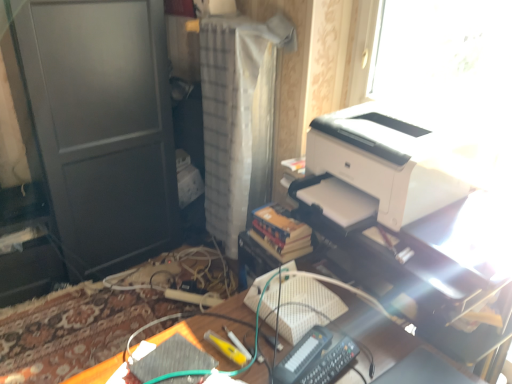
Describe the element at coordinates (395, 157) in the screenshot. This screenshot has height=384, width=512. I see `white matte printer at upper right` at that location.

This screenshot has width=512, height=384. I want to click on black plastic remote control at center, so click(315, 359).

Does point (233, 233) come closer to viewer compared to point (402, 350)?

No, it is behind (402, 350).

Where is `curtain that is above the wooden desk at center (from the image's perspective)`? The image size is (512, 384). curtain that is above the wooden desk at center (from the image's perspective) is located at coordinates (234, 114).

Is white textured curtain at center far from wooden desk at center?

white textured curtain at center is near wooden desk at center, not far away.

Considering the relative sizes of white textured curtain at center and wooden desk at center in the image provided, is white textured curtain at center thinner than wooden desk at center?

Indeed, white textured curtain at center has a lesser width compared to wooden desk at center.

From the image's perspective, is wooden desk at center located above or below black plastic remote control at center?

wooden desk at center is below black plastic remote control at center.

From a real-world perspective, does wooden desk at center stand above black plastic remote control at center?

No.

Who is bigger, wooden desk at center or black plastic remote control at center?

wooden desk at center is bigger.

Which is correct: wooden desk at center is inside black plastic remote control at center, or outside of it?

wooden desk at center is outside black plastic remote control at center.

From a real-world perspective, is black plastic remote control at center positioned above or below wooden desk at center?

From a real-world perspective, black plastic remote control at center is physically above wooden desk at center.

Does black plastic remote control at center have a greater height compared to wooden desk at center?

No.

Measure the distance from black plastic remote control at center to wooden desk at center.

black plastic remote control at center and wooden desk at center are 5.01 inches apart from each other.

In the scene shown: Which object is closer to the camera, black plastic remote control at center or wooden desk at center?

wooden desk at center is more forward.

From the image's perspective, between white glossy printer at upper right and white matte printer at upper right, which one is located above?

white glossy printer at upper right, from the image's perspective.

From a real-world perspective, which object rests below the other?

In real-world perspective, white matte printer at upper right is lower.

Does white glossy printer at upper right have a lesser height compared to white matte printer at upper right?

In fact, white glossy printer at upper right may be taller than white matte printer at upper right.

Is white textured curtain at center spatially inside black plastic remote control at center, or outside of it?

white textured curtain at center is spatially situated outside black plastic remote control at center.

Can you confirm if white textured curtain at center is positioned to the right of black plastic remote control at center?

Incorrect, white textured curtain at center is not on the right side of black plastic remote control at center.

Considering the sizes of white textured curtain at center and black plastic remote control at center in the image, is white textured curtain at center taller or shorter than black plastic remote control at center?

white textured curtain at center is taller than black plastic remote control at center.

Is white textured curtain at center aimed at black plastic remote control at center?

No, white textured curtain at center is not aimed at black plastic remote control at center.

Is wooden desk at center turned away from white matte printer at upper right?

wooden desk at center is not turned away from white matte printer at upper right.

Consider the image. What's the angular difference between wooden desk at center and white matte printer at upper right's facing directions?

The angle between the facing direction of wooden desk at center and the facing direction of white matte printer at upper right is 87.3 degrees.

Between wooden desk at center and white matte printer at upper right, which one has less height?

white matte printer at upper right is shorter.

Is white glossy printer at upper right positioned far away from white textured curtain at center?

That's not correct — white glossy printer at upper right is a little close to white textured curtain at center.

Do you think white glossy printer at upper right is within white textured curtain at center, or outside of it?

white glossy printer at upper right is not enclosed by white textured curtain at center.

Is white glossy printer at upper right behind white textured curtain at center?

No, white glossy printer at upper right is closer to the viewer.

Is white glossy printer at upper right aimed at white textured curtain at center?

No, white glossy printer at upper right is not facing towards white textured curtain at center.

The height and width of the screenshot is (384, 512). Find the location of `desk that appears in front of the white textured curtain at center`. desk that appears in front of the white textured curtain at center is located at coordinates (396, 346).

The height and width of the screenshot is (384, 512). I want to click on desk below the black plastic remote control at center (from the image's perspective), so click(x=396, y=346).

Considering their positions, is black plastic remote control at center positioned further to white textured curtain at center than wooden desk at center?

black plastic remote control at center lies further to white textured curtain at center than the other object.

Based on the photo, from the image, which object appears to be nearer to white textured curtain at center, wooden desk at center or white matte printer at upper right?

white matte printer at upper right is positioned closer to the anchor white textured curtain at center.

Considering their positions, is white textured curtain at center positioned further to wooden desk at center than white glossy printer at upper right?

The object further to wooden desk at center is white glossy printer at upper right.

Based on the photo, looking at the image, which one is located further to white matte printer at upper right, white glossy printer at upper right or wooden desk at center?

wooden desk at center is positioned further to the anchor white matte printer at upper right.

From the image, which object appears to be nearer to wooden desk at center, white textured curtain at center or black plastic remote control at center?

black plastic remote control at center is closer to wooden desk at center.

Estimate the real-world distances between objects in this image. Which object is further from black plastic remote control at center, white matte printer at upper right or white textured curtain at center?

The object further to black plastic remote control at center is white textured curtain at center.

Based on their spatial positions, is black plastic remote control at center or white textured curtain at center closer to wooden desk at center?

The object closer to wooden desk at center is black plastic remote control at center.

Which object lies further to the anchor point white textured curtain at center, white glossy printer at upper right or white matte printer at upper right?

Among the two, white glossy printer at upper right is located further to white textured curtain at center.

This screenshot has width=512, height=384. I want to click on printer between white glossy printer at upper right and wooden desk at center in the vertical direction, so click(x=395, y=157).

Find the location of a particular element. This screenshot has width=512, height=384. curtain between white glossy printer at upper right and wooden desk at center in the vertical direction is located at coordinates (234, 114).

Find the location of a particular element. Image resolution: width=512 pixels, height=384 pixels. equipment between white matte printer at upper right and wooden desk at center in the vertical direction is located at coordinates (315, 359).

You are a GUI agent. You are given a task and a screenshot of the screen. Output one action in this format:
    pyautogui.click(x=<x>, y=<y>)
    Task: Click on the equipment between white textured curtain at center and white glossy printer at upper right in the horizontal direction
    This screenshot has width=512, height=384.
    Given the screenshot: What is the action you would take?
    pyautogui.click(x=315, y=359)